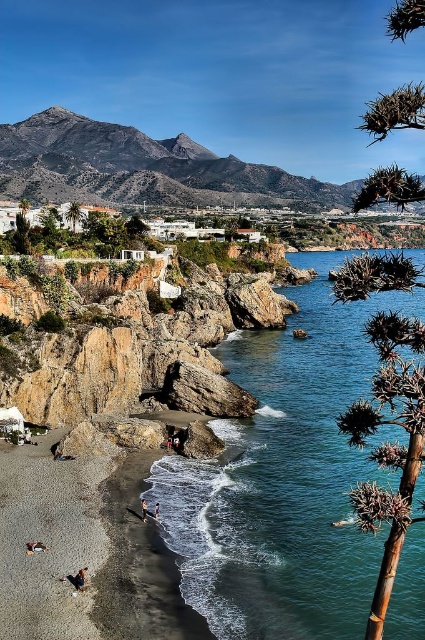
You are a photographer planning to capture a landscape shot of the rugged brown rock formation at upper center and the green leafy tree at center. Based on their sizes, which object should you focus on to ensure it dominates the composition?

The rugged brown rock formation at upper center should be the focus since it is larger in size than the green leafy tree at center, making it naturally dominate the composition.